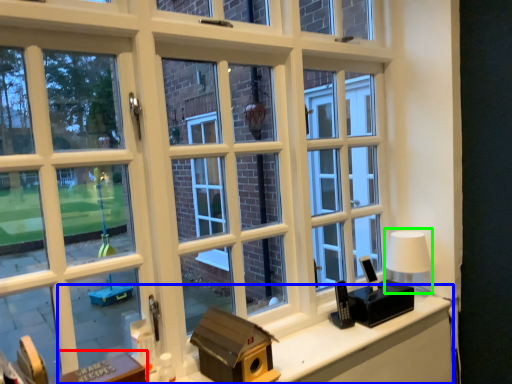
Question: Which is nearer to the table (highlighted by a red box)? computer desk (highlighted by a blue box) or table lamp (highlighted by a green box).

Choices:
 (A) computer desk
 (B) table lamp

Answer: (A)